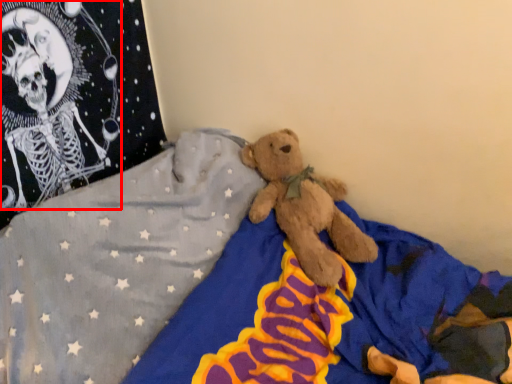
Question: From the image's perspective, what is the correct spatial relationship of toy (annotated by the red box) in relation to bed?

Choices:
 (A) below
 (B) above

Answer: (B)